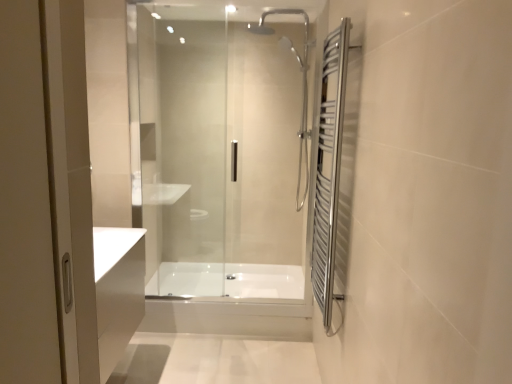
From the picture: Measure the distance between point (x=267, y=240) and camera.

A distance of 3.54 meters exists between point (x=267, y=240) and camera.

What do you see at coordinates (221, 147) in the screenshot? Image resolution: width=512 pixels, height=384 pixels. I see `transparent glass shower door at center` at bounding box center [221, 147].

Find the location of a particular element. This screenshot has width=512, height=384. polished chrome towel rack at right is located at coordinates (329, 166).

In the image, is polished chrome towel rack at right on the left side or the right side of transparent glass shower door at center?

polished chrome towel rack at right is to the right of transparent glass shower door at center.

Between point (329, 44) and point (195, 235), which one is positioned in front?

The point (329, 44) is closer to the camera.

Is polished chrome towel rack at right in contact with transparent glass shower door at center?

polished chrome towel rack at right and transparent glass shower door at center are not in contact.

From the image's perspective, which one is positioned higher, polished chrome towel rack at right or transparent glass shower door at center?

transparent glass shower door at center is shown above in the image.

In the scene shown: In terms of width, does white glossy bathtub at center, the 1th bath viewed from the back, look wider or thinner when compared to transparent glass shower door at center?

In the image, white glossy bathtub at center, the 1th bath viewed from the back, appears to be wider than transparent glass shower door at center.

Between white glossy bathtub at center, which appears as the second bath when viewed from the front, and transparent glass shower door at center, which one has larger size?

With larger size is transparent glass shower door at center.

Is white glossy bathtub at center, which appears as the second bath when viewed from the front, positioned beyond the bounds of transparent glass shower door at center?

Absolutely, white glossy bathtub at center, which appears as the second bath when viewed from the front, is external to transparent glass shower door at center.

From a real-world perspective, between white glossy bathtub at center, the 1th bath viewed from the back, and transparent glass shower door at center, who is vertically higher?

In real-world perspective, transparent glass shower door at center is above.

Locate an element on the screen. The width and height of the screenshot is (512, 384). bath behind the white glossy bathtub at center, acting as the second bath starting from the back is located at coordinates coord(228,280).

From a real-world perspective, is white glossy bathtub at center, which appears as the second bath when viewed from the front, below white glossy bathtub at center, acting as the second bath starting from the back?

No.

Does white glossy bathtub at center, the 1th bath viewed from the back, have a lesser height compared to white glossy bathtub at center, acting as the second bath starting from the back?

Yes.

Does white glossy bathtub at center, the first bath in the front-to-back sequence, have a larger size compared to transparent glass shower door at center?

No.

From a real-world perspective, is white glossy bathtub at center, the first bath in the front-to-back sequence, positioned above or below transparent glass shower door at center?

white glossy bathtub at center, the first bath in the front-to-back sequence, is below transparent glass shower door at center.

Where is `bath that is the 2nd object directly below the transparent glass shower door at center (from a real-world perspective)`? bath that is the 2nd object directly below the transparent glass shower door at center (from a real-world perspective) is located at coordinates (242, 306).

Which of these two, transparent glass shower door at center or white glossy bathtub at center, acting as the second bath starting from the back, is smaller?

white glossy bathtub at center, acting as the second bath starting from the back, is smaller.

Is transparent glass shower door at center wider or thinner than white glossy bathtub at center, the first bath in the front-to-back sequence?

In the image, transparent glass shower door at center appears to be wider than white glossy bathtub at center, the first bath in the front-to-back sequence.

Is transparent glass shower door at center in front of or behind white glossy bathtub at center, the first bath in the front-to-back sequence, in the image?

In the image, transparent glass shower door at center appears in front of white glossy bathtub at center, the first bath in the front-to-back sequence.

Can you tell me how much transparent glass shower door at center and white glossy bathtub at center, the first bath in the front-to-back sequence, differ in facing direction?

The angular difference between transparent glass shower door at center and white glossy bathtub at center, the first bath in the front-to-back sequence, is 0.387 degrees.

Between white glossy bathtub at center, the first bath in the front-to-back sequence, and white glossy bathtub at center, the 1th bath viewed from the back, which one appears on the right side from the viewer's perspective?

From the viewer's perspective, white glossy bathtub at center, the 1th bath viewed from the back, appears more on the right side.

In the scene shown: Considering the sizes of objects white glossy bathtub at center, the first bath in the front-to-back sequence, and white glossy bathtub at center, which appears as the second bath when viewed from the front, in the image provided, who is bigger, white glossy bathtub at center, the first bath in the front-to-back sequence, or white glossy bathtub at center, which appears as the second bath when viewed from the front,?

With larger size is white glossy bathtub at center, which appears as the second bath when viewed from the front.

Is white glossy bathtub at center, the first bath in the front-to-back sequence, oriented away from white glossy bathtub at center, the 1th bath viewed from the back?

That's right, white glossy bathtub at center, the first bath in the front-to-back sequence, is facing away from white glossy bathtub at center, the 1th bath viewed from the back.

Is point (142, 325) more distant than point (319, 238)?

Yes, point (142, 325) is behind point (319, 238).

Considering the sizes of white glossy bathtub at center, acting as the second bath starting from the back, and polished chrome towel rack at right in the image, is white glossy bathtub at center, acting as the second bath starting from the back, wider or thinner than polished chrome towel rack at right?

white glossy bathtub at center, acting as the second bath starting from the back, is thinner than polished chrome towel rack at right.

Is there a large distance between white glossy bathtub at center, acting as the second bath starting from the back, and polished chrome towel rack at right?

No, there isn't a large distance between white glossy bathtub at center, acting as the second bath starting from the back, and polished chrome towel rack at right.

The height and width of the screenshot is (384, 512). I want to click on screen door in front of the transparent glass shower door at center, so click(329, 166).

Where is `bath that is the 1st one below the transparent glass shower door at center (from a real-world perspective)`? bath that is the 1st one below the transparent glass shower door at center (from a real-world perspective) is located at coordinates (228, 280).

Which object lies nearer to the anchor point white glossy bathtub at center, which appears as the second bath when viewed from the front, polished chrome towel rack at right or transparent glass shower door at center?

transparent glass shower door at center is closer to white glossy bathtub at center, which appears as the second bath when viewed from the front.

Estimate the real-world distances between objects in this image. Which object is closer to white glossy bathtub at center, acting as the second bath starting from the back, transparent glass shower door at center or white glossy bathtub at center, the 1th bath viewed from the back?

Based on the image, white glossy bathtub at center, the 1th bath viewed from the back, appears to be nearer to white glossy bathtub at center, acting as the second bath starting from the back.

Estimate the real-world distances between objects in this image. Which object is closer to polished chrome towel rack at right, white glossy bathtub at center, acting as the second bath starting from the back, or white glossy bathtub at center, which appears as the second bath when viewed from the front?

white glossy bathtub at center, acting as the second bath starting from the back, lies closer to polished chrome towel rack at right than the other object.

Based on their spatial positions, is polished chrome towel rack at right or white glossy bathtub at center, the first bath in the front-to-back sequence, further from transparent glass shower door at center?

white glossy bathtub at center, the first bath in the front-to-back sequence, lies further to transparent glass shower door at center than the other object.

From the image, which object appears to be farther from white glossy bathtub at center, the 1th bath viewed from the back, polished chrome towel rack at right or white glossy bathtub at center, the first bath in the front-to-back sequence?

polished chrome towel rack at right.

Consider the image. Estimate the real-world distances between objects in this image. Which object is closer to transparent glass shower door at center, white glossy bathtub at center, acting as the second bath starting from the back, or white glossy bathtub at center, which appears as the second bath when viewed from the front?

white glossy bathtub at center, which appears as the second bath when viewed from the front.

From the image, which object appears to be farther from white glossy bathtub at center, which appears as the second bath when viewed from the front, white glossy bathtub at center, the first bath in the front-to-back sequence, or transparent glass shower door at center?

The object further to white glossy bathtub at center, which appears as the second bath when viewed from the front, is transparent glass shower door at center.

Based on their spatial positions, is transparent glass shower door at center or polished chrome towel rack at right closer to white glossy bathtub at center, the 1th bath viewed from the back?

transparent glass shower door at center lies closer to white glossy bathtub at center, the 1th bath viewed from the back, than the other object.

Where is `bath between transparent glass shower door at center and white glossy bathtub at center, the first bath in the front-to-back sequence, in the up-down direction`? The image size is (512, 384). bath between transparent glass shower door at center and white glossy bathtub at center, the first bath in the front-to-back sequence, in the up-down direction is located at coordinates (228, 280).

What are the coordinates of `bath located between polished chrome towel rack at right and white glossy bathtub at center, the 1th bath viewed from the back, in the depth direction` in the screenshot? It's located at (242, 306).

I want to click on shower door positioned between polished chrome towel rack at right and white glossy bathtub at center, which appears as the second bath when viewed from the front, from near to far, so click(x=221, y=147).

The height and width of the screenshot is (384, 512). I want to click on shower door positioned between polished chrome towel rack at right and white glossy bathtub at center, the first bath in the front-to-back sequence, from near to far, so click(221, 147).